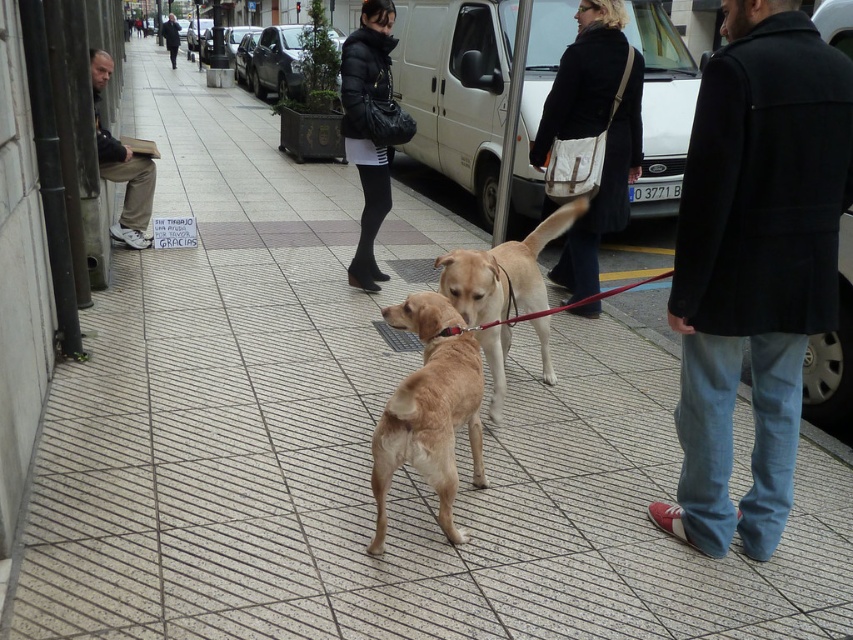
Question: Is the position of light brown fur at center more distant than that of light brown leather jacket at left?

Choices:
 (A) yes
 (B) no

Answer: (B)

Question: Which object appears farthest from the camera in this image?

Choices:
 (A) dark blue wool coat at center
 (B) light brown fur at center

Answer: (B)

Question: Can you confirm if light brown fur at center is positioned to the left of light brown leather jacket at left?

Choices:
 (A) no
 (B) yes

Answer: (A)

Question: Which point is closer to the camera?

Choices:
 (A) (352, 65)
 (B) (508, 332)
 (C) (605, 128)
 (D) (706, 81)

Answer: (D)

Question: Does matte black coat at center have a smaller size compared to light brown fur at center?

Choices:
 (A) no
 (B) yes

Answer: (A)

Question: Which point is closer to the camera?

Choices:
 (A) (167, 38)
 (B) (352, 273)

Answer: (B)